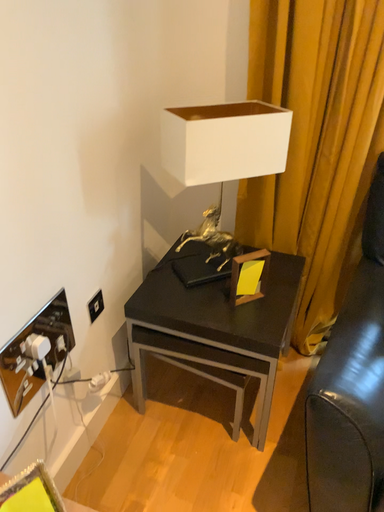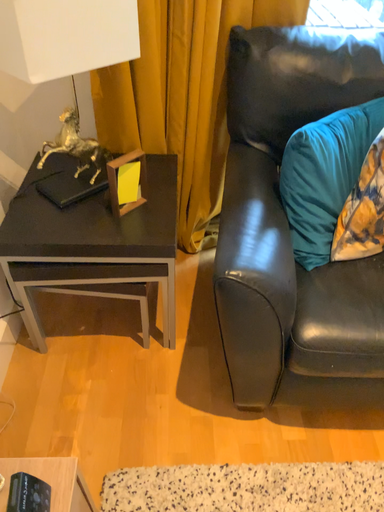
Question: Which way did the camera rotate in the video?

Choices:
 (A) rotated downward
 (B) rotated upward

Answer: (A)